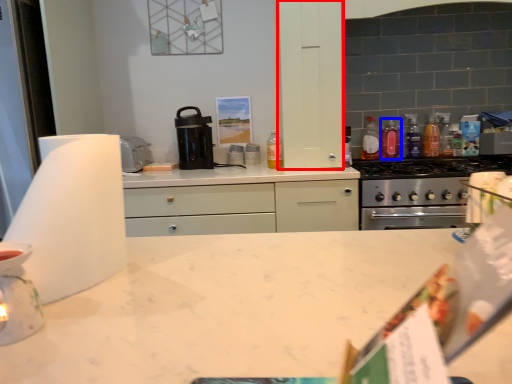
Question: Which object is further to the camera taking this photo, cabinetry (highlighted by a red box) or bottle (highlighted by a blue box)?

Choices:
 (A) cabinetry
 (B) bottle

Answer: (B)